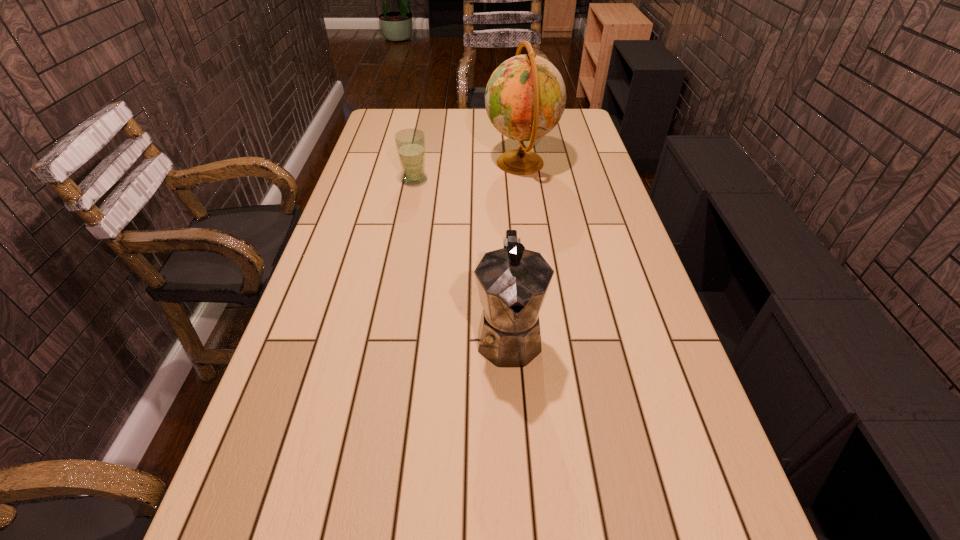
Locate an element on the screen. This screenshot has height=540, width=960. globe is located at coordinates (525, 97).

The image size is (960, 540). Identify the location of the second tallest object. (512, 282).

The width and height of the screenshot is (960, 540). What are the coordinates of `coffeepot` in the screenshot? It's located at (512, 282).

Where is `the leftmost object`? The image size is (960, 540). the leftmost object is located at coordinates (410, 143).

Where is `glass`? glass is located at coordinates (410, 143).

Locate an element on the screen. The height and width of the screenshot is (540, 960). vacant region located on the left of the tallest object is located at coordinates (468, 163).

Find the location of a particular element. vacant space located on the pouring side of the second shortest object is located at coordinates (514, 411).

You are a GUI agent. You are given a task and a screenshot of the screen. Output one action in this format:
    pyautogui.click(x=<x>, y=<y>)
    Task: Click on the vacant point located 0.260m on the front of the glass
    
    Given the screenshot: What is the action you would take?
    pyautogui.click(x=404, y=235)

Image resolution: width=960 pixels, height=540 pixels. In the image, there is a desktop. In order to click on vacant space at the far edge in this screenshot , I will do `click(475, 116)`.

The width and height of the screenshot is (960, 540). What are the coordinates of `vacant area at the left edge` in the screenshot? It's located at (356, 194).